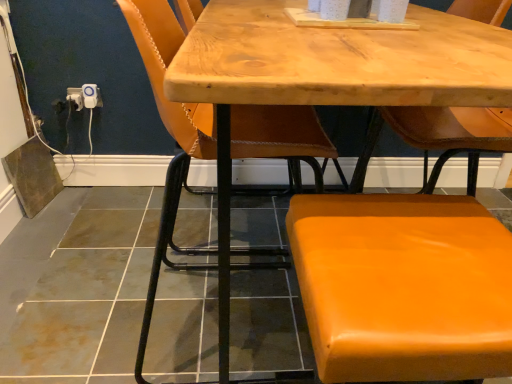
Locate an element on the screen. The width and height of the screenshot is (512, 384). free point to the left of orange leather chair at center, the 1th chair from the left is located at coordinates (92, 304).